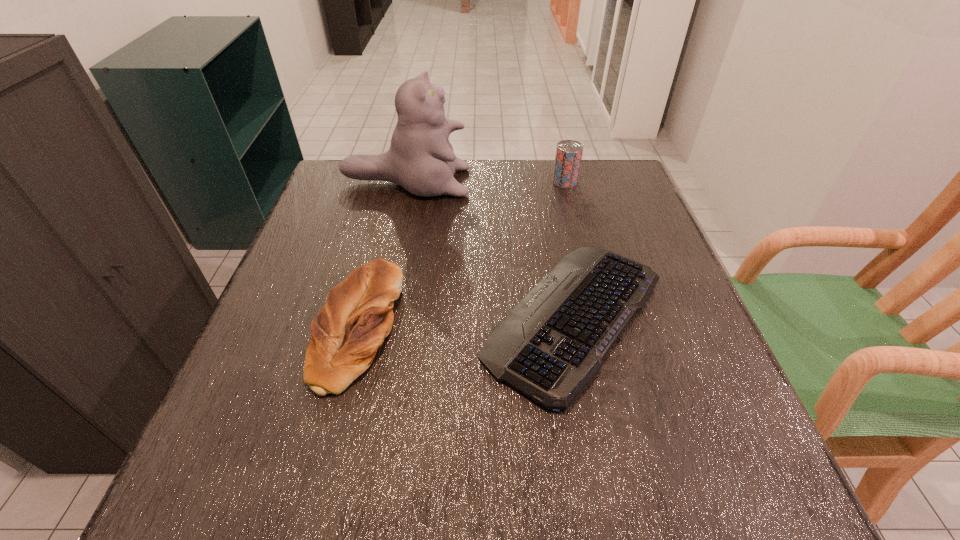
What are the coordinates of `cat situated at the left edge` in the screenshot? It's located at (421, 159).

You are a GUI agent. You are given a task and a screenshot of the screen. Output one action in this format:
    pyautogui.click(x=<x>, y=<y>)
    Task: Click on the bread present at the left edge
    Image resolution: width=960 pixels, height=540 pixels.
    Given the screenshot: What is the action you would take?
    pyautogui.click(x=358, y=315)

What are the coordinates of `beer can located in the right edge section of the desktop` in the screenshot? It's located at tap(568, 156).

The width and height of the screenshot is (960, 540). Identify the location of computer keyboard present at the right edge. (551, 344).

Locate an element on the screen. object situated at the far left corner is located at coordinates (x=421, y=159).

Locate an element on the screen. The width and height of the screenshot is (960, 540). object that is at the far right corner is located at coordinates (568, 156).

This screenshot has height=540, width=960. In the image, there is a desktop. Identify the location of vacant space at the far edge. (529, 191).

Identify the location of blank space at the near edge of the desktop. (330, 491).

This screenshot has width=960, height=540. In order to click on vacant position at the left edge of the desktop in this screenshot , I will do `click(217, 426)`.

Image resolution: width=960 pixels, height=540 pixels. In order to click on vacant area at the right edge in this screenshot , I will do `click(616, 213)`.